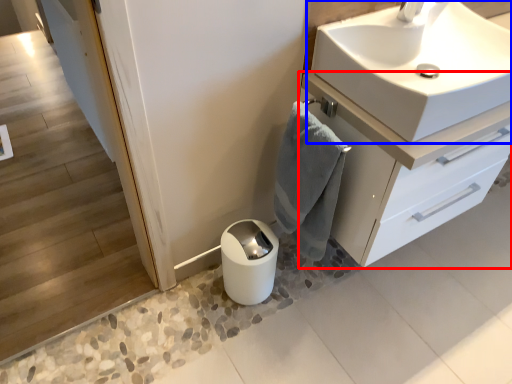
Question: Which object appears farthest to the camera in this image, bathroom cabinet (highlighted by a red box) or sink (highlighted by a blue box)?

Choices:
 (A) bathroom cabinet
 (B) sink

Answer: (A)